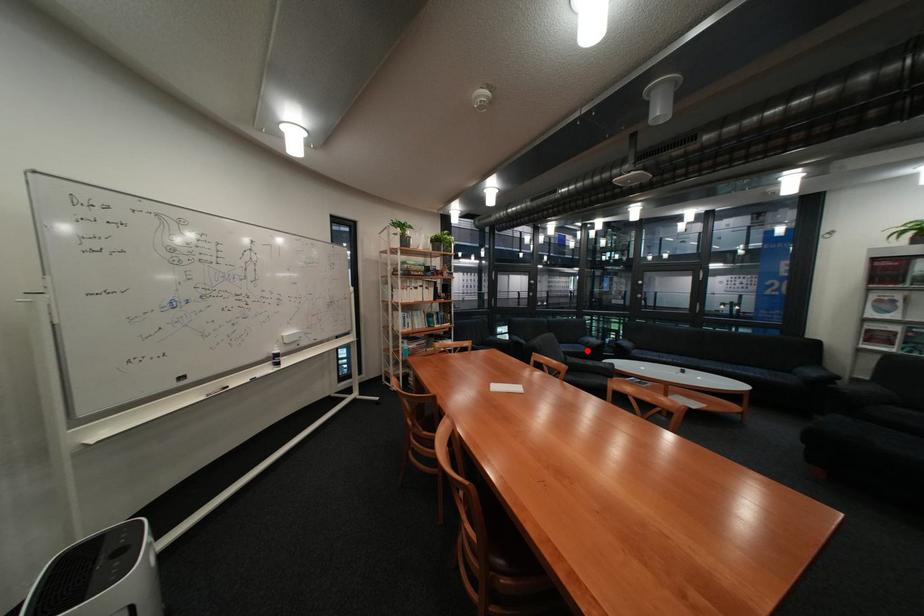
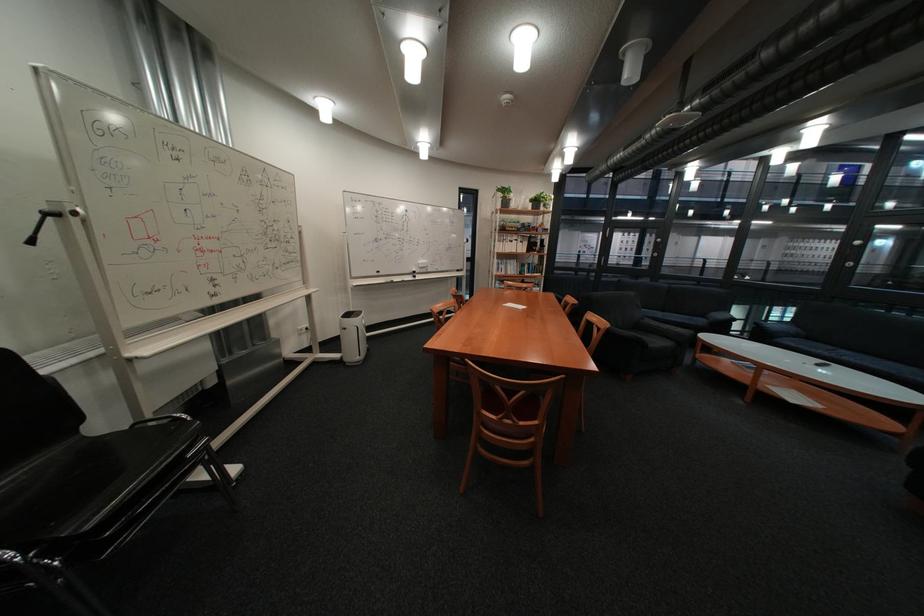
The point at the highlighted location is marked in the first image. Where is the corresponding point in the second image?

(698, 321)